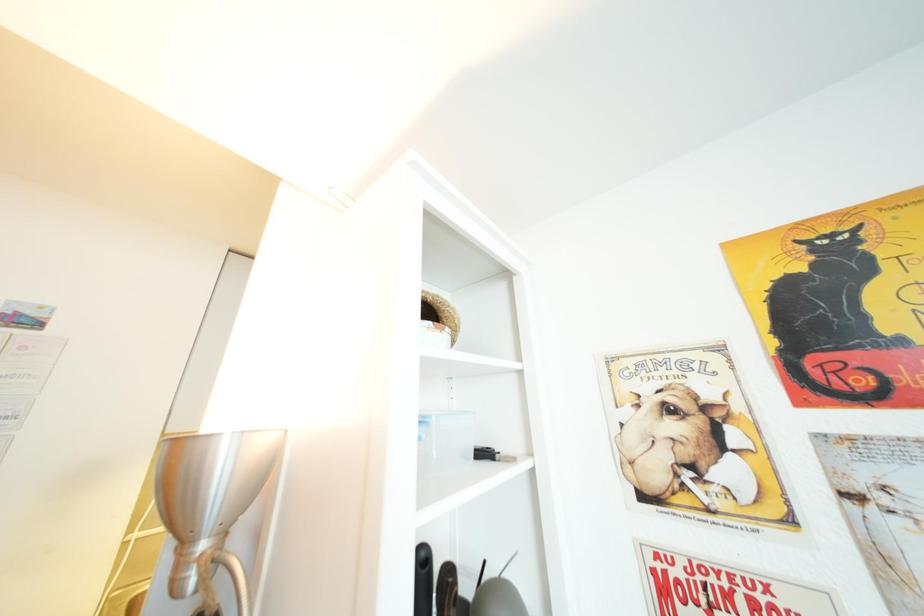
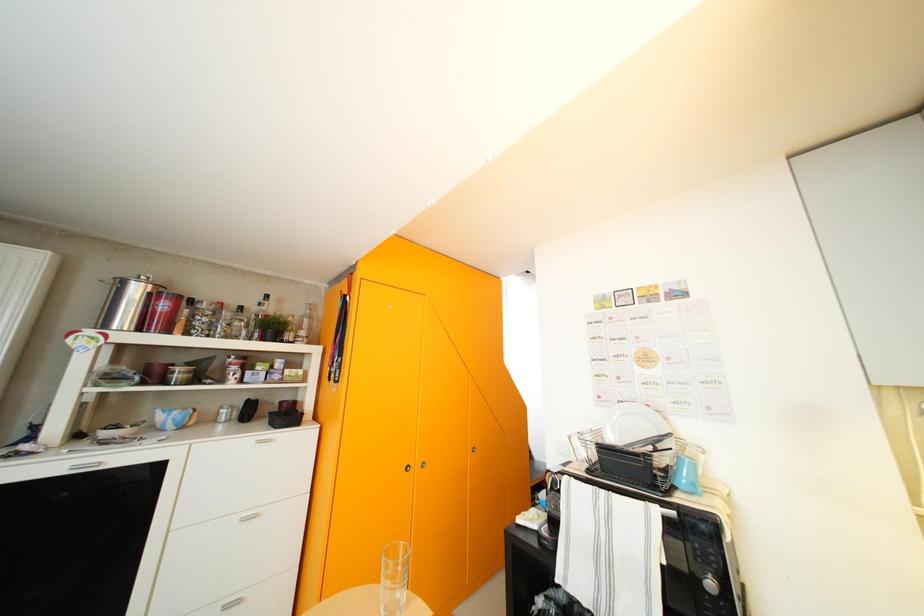
Question: The camera is either moving clockwise (left) or counter-clockwise (right) around the object. The first image is from the beginning of the video and the second image is from the end. Is the camera moving left or right when shooting the video?

Choices:
 (A) Left
 (B) Right

Answer: (B)